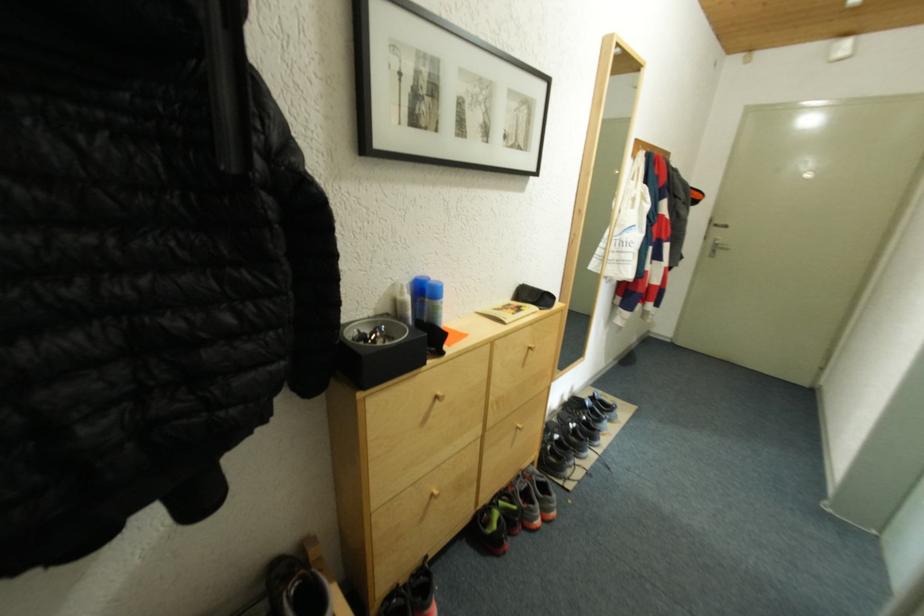
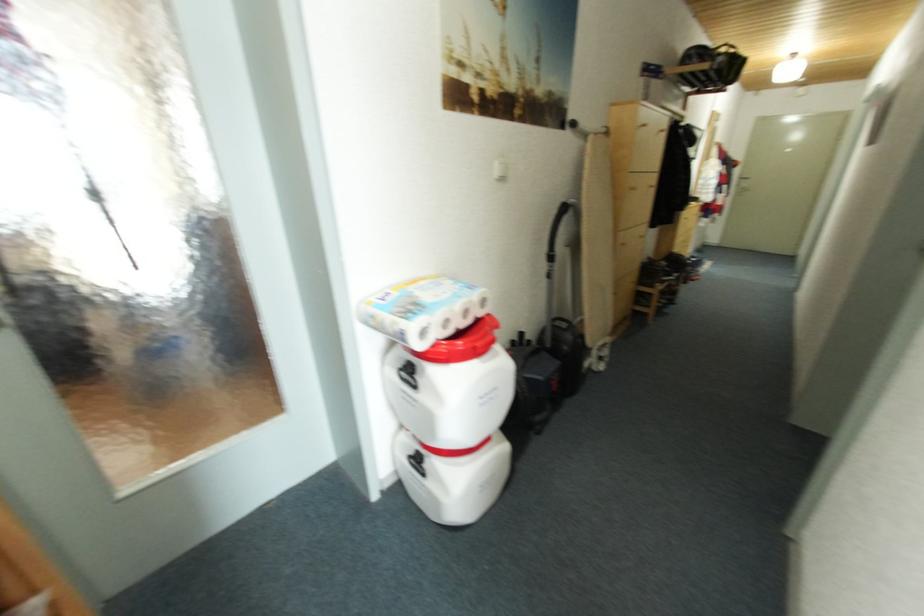
What movement of the cameraman would produce the second image?

The cameraman moved toward left, backward.